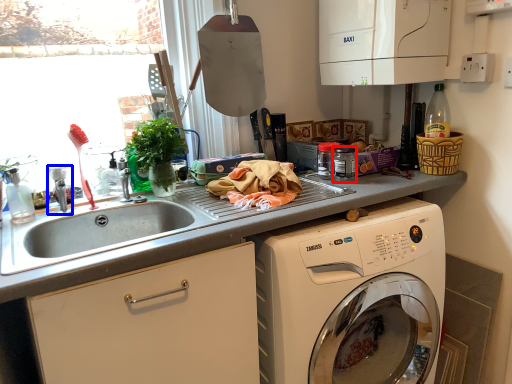
Question: Which object appears closest to the camera in this image, appliance (highlighted by a red box) or faucet (highlighted by a blue box)?

Choices:
 (A) appliance
 (B) faucet

Answer: (B)